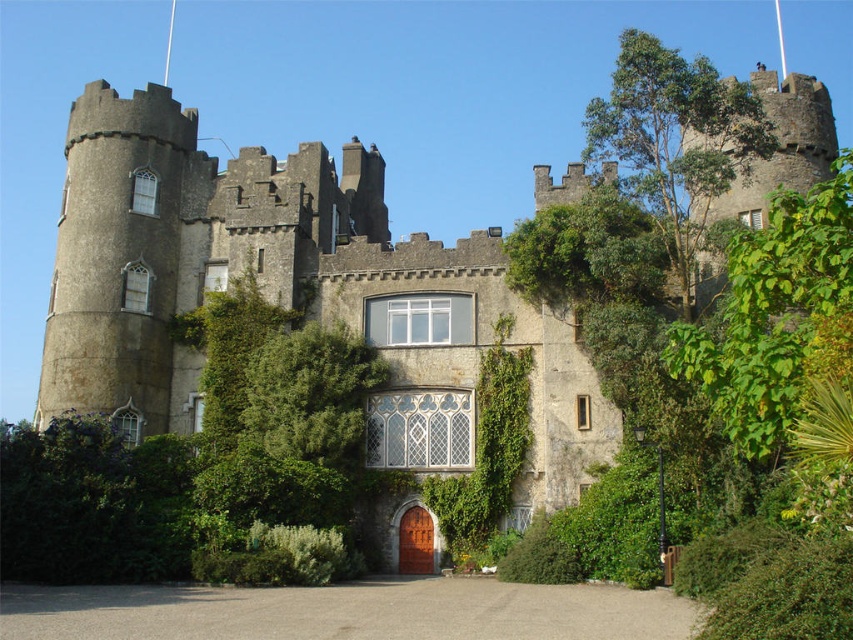
From the picture: You are a visitor arriving at the gray stone castle at center. You see the gray gravel driveway at lower center leading up to the entrance. Which direction should you turn to face the castle from the driveway?

The gray stone castle at center is to the right of the gray gravel driveway at lower center, so you should turn to your right to face the castle from the driveway.

You are standing at the point marked by the coordinates point (271, 276) in the image. What structure are you directly facing?

The point (271, 276) marks the gray stone castle at center, so you are directly facing the gray stone castle at center.